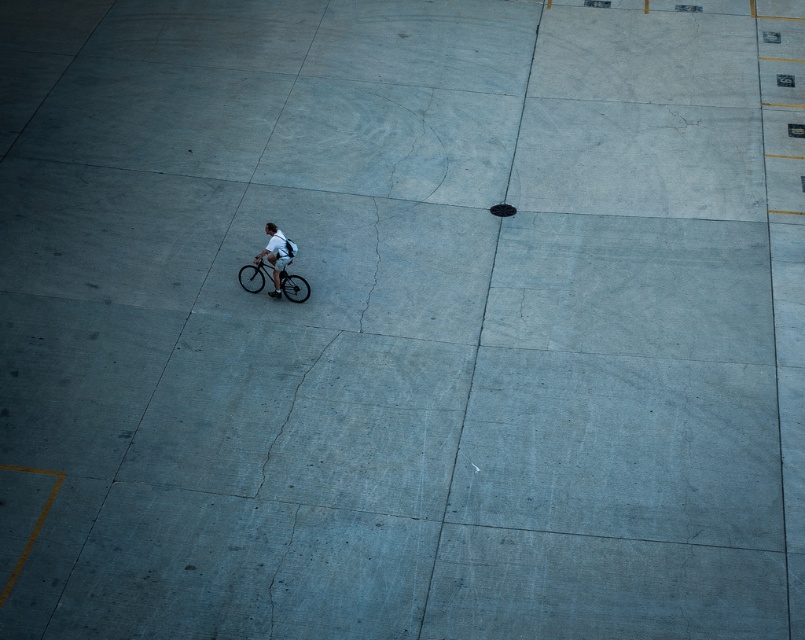
You are a delivery person who needs to park your shiny metallic bicycle at center and matte black bicycle at center in a parking area that allows a minimum distance of 16 inches between vehicles. Can both bicycles be parked there without violating the parking rule?

The shiny metallic bicycle at center is 15.80 inches from matte black bicycle at center, which is less than the required 16 inches. Therefore, they cannot be parked there without violating the parking rule.

You are standing at point (279, 288) and want to walk to point (302, 288). Which direction should you face to move towards your destination?

You should face downward because point (302, 288) is behind point (279, 288).